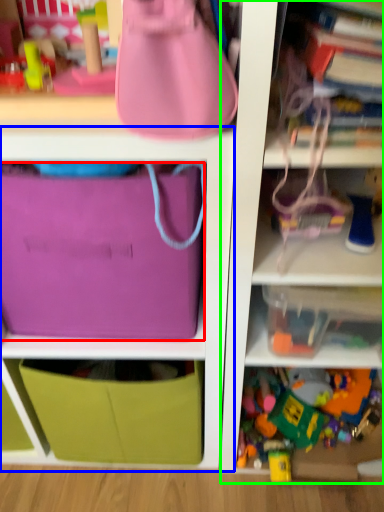
Question: Considering the real-world distances, which object is closest to pouch (highlighted by a red box)? cabinet (highlighted by a blue box) or shelf (highlighted by a green box).

Choices:
 (A) cabinet
 (B) shelf

Answer: (A)